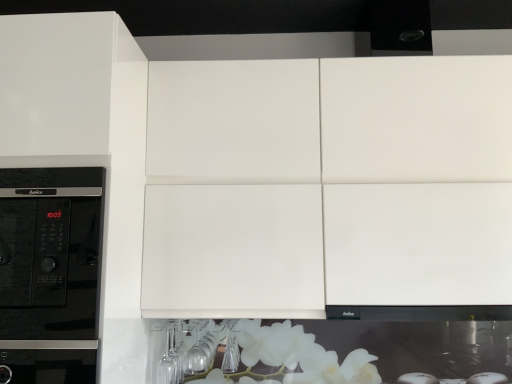
What do you see at coordinates (50, 273) in the screenshot? I see `black glossy microwave at left` at bounding box center [50, 273].

The image size is (512, 384). What are the coordinates of `black glossy microwave at left` in the screenshot? It's located at pyautogui.click(x=50, y=273).

At what (x,y) coordinates should I click in order to perform the action: click on black glossy microwave at left. Please return your answer as a coordinate pair (x, y). Looking at the image, I should click on (50, 273).